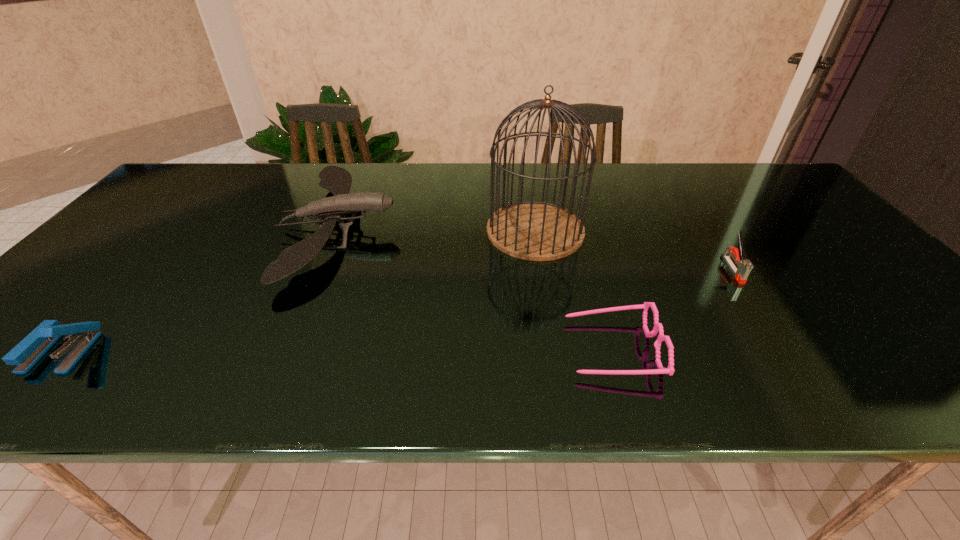
You are a GUI agent. You are given a task and a screenshot of the screen. Output one action in this format:
    pyautogui.click(x=<x>, y=<y>)
    Task: Click on the vacant space located 0.080m at the head of the fourth object from right to left
    This screenshot has width=960, height=540.
    Given the screenshot: What is the action you would take?
    pyautogui.click(x=426, y=228)

Identify the location of blank area located 0.270m on the handle side of the rightmost object. (804, 377).

The width and height of the screenshot is (960, 540). Identify the location of free space located on the back of the nearer stapler. (145, 259).

Locate an element on the screen. vacant space located 0.320m on the arms of the spectacles is located at coordinates (413, 348).

At what (x,y) coordinates should I click in order to perform the action: click on vacant space situated on the arms of the spectacles. Please return your answer as a coordinate pair (x, y). Looking at the image, I should click on (422, 348).

Locate an element on the screen. vacant space located 0.300m on the arms of the spectacles is located at coordinates (422, 348).

This screenshot has height=540, width=960. Find the location of `object present at the far edge`. object present at the far edge is located at coordinates (337, 180).

This screenshot has height=540, width=960. Find the location of `stapler that is at the near edge`. stapler that is at the near edge is located at coordinates (30, 350).

Locate an element on the screen. spectacles located at the near edge is located at coordinates (658, 327).

Locate an element on the screen. This screenshot has height=540, width=960. object at the left edge is located at coordinates (30, 350).